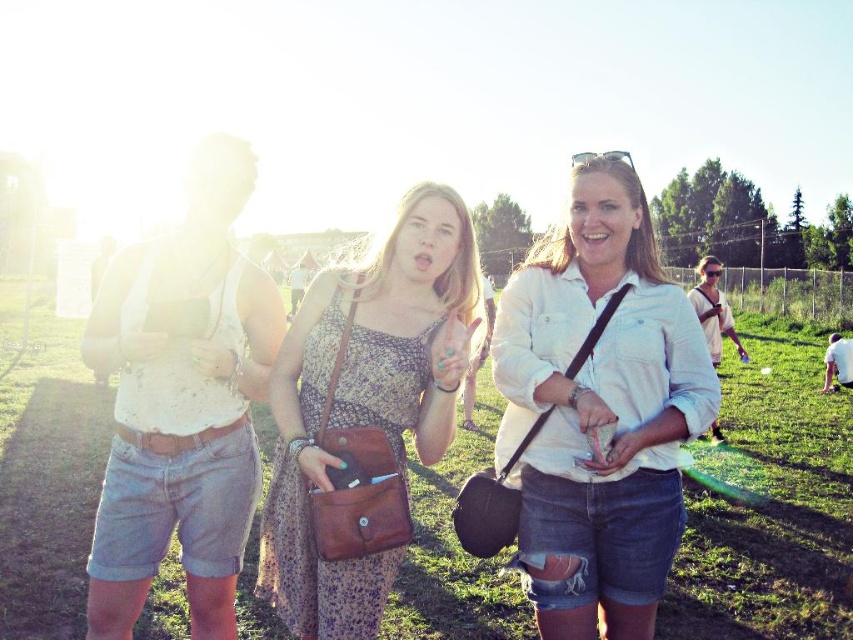
You are standing at point A located at coordinates point (x=558, y=465) and want to walk to point B located at coordinates point (x=485, y=580). However, there is an obstacle between them. Based on the scene description, will you be able to see point B from your current position at point A?

Since point (x=485, y=580) is behind point (x=558, y=465), you will not be able to see point B from your current position at point A as it is obstructed by the object at point A.

Based on the scene description, where is the point located at coordinates (770,506)?

The point at coordinates (770,506) corresponds to the green grass at center.

You are standing in the middle of the grassy field and notice the green grass at center. Where exactly is this grass located in relation to the other elements in the scene?

The green grass at center is located at point coordinates 0.792 on the x and 0.905 on the y axis.